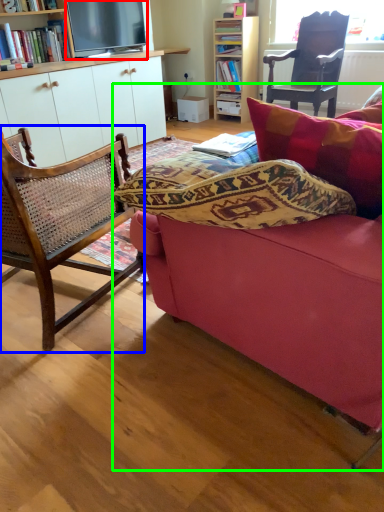
Question: Based on their relative distances, which object is nearer to television (highlighted by a red box)? Choose from chair (highlighted by a blue box) and studio couch (highlighted by a green box).

Choices:
 (A) chair
 (B) studio couch

Answer: (A)